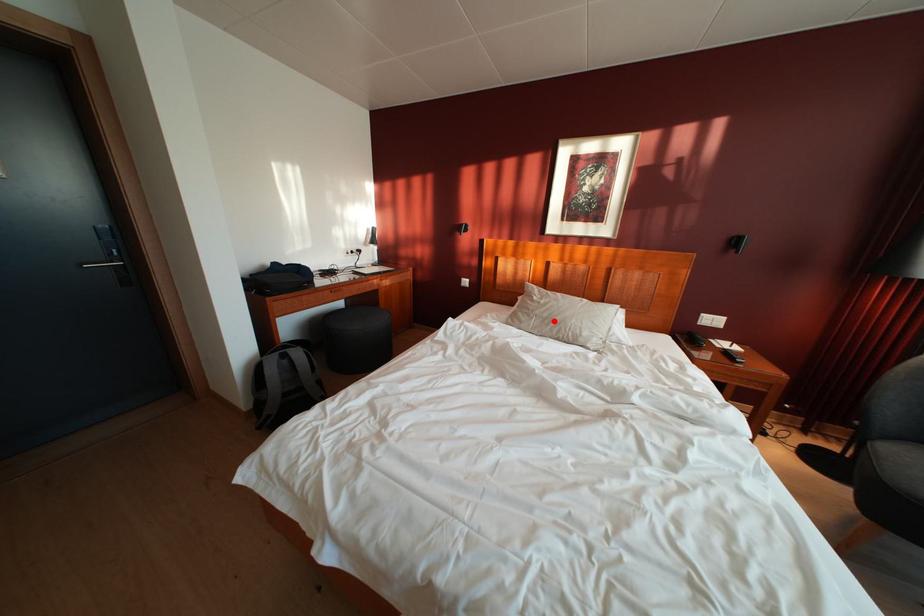
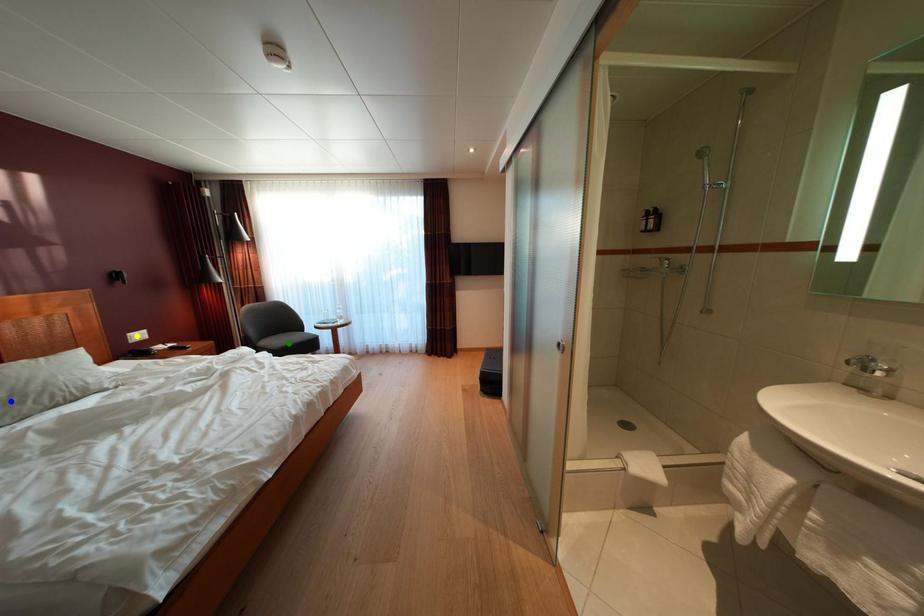
Question: I am providing you with two images of the same scene from different viewpoints. A red point is marked on the first image. You are given multiple points on the second image. In image 2, which mark is for the same physical point as the one in image 1?

Choices:
 (A) blue point
 (B) green point
 (C) yellow point

Answer: (A)